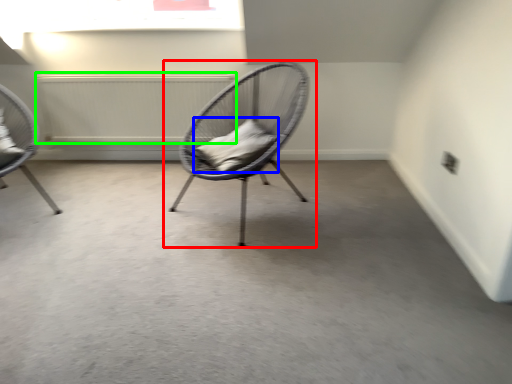
Question: Estimate the real-world distances between objects in this image. Which object is closer to chair (highlighted by a red box), pillow (highlighted by a blue box) or radiator (highlighted by a green box)?

Choices:
 (A) pillow
 (B) radiator

Answer: (A)